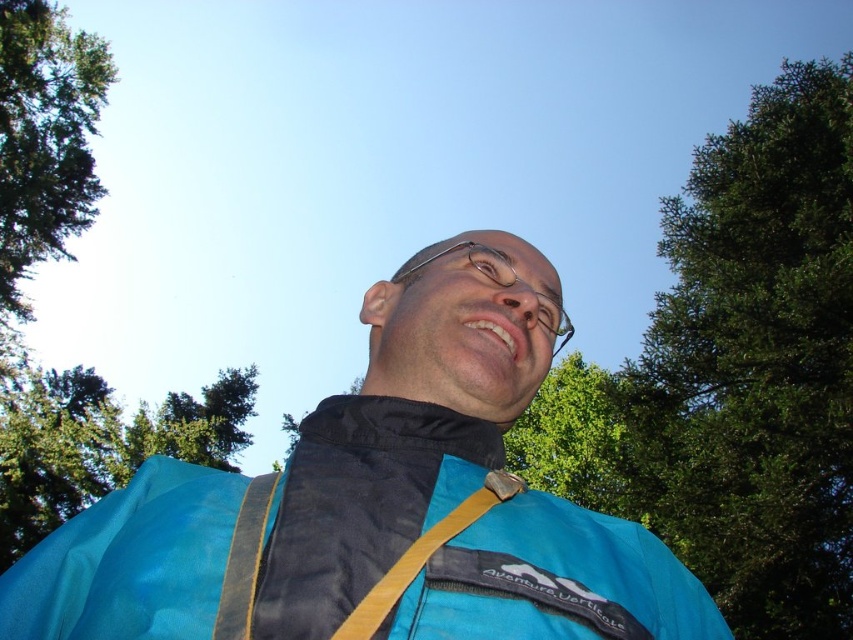
You are a photographer trying to capture a clear photo of the clear plastic glasses at center. However, the green leafy tree at upper right is blocking your view. Can you adjust your position to take the photo without the tree obstructing the glasses?

The clear plastic glasses at center is behind the green leafy tree at upper right, so moving your position to the left or right might allow you to see around the tree and capture the glasses without obstruction.

You are a photographer trying to capture a photo of the blue fabric jacket at center and the green leafy tree at upper right. Which object should you focus on first to ensure both are in sharp focus?

The blue fabric jacket at center is closer to the viewer than the green leafy tree at upper right. To ensure both are in sharp focus, you should focus on the green leafy tree at upper right first because it is farther away, allowing the jacket to be within the depth of field range when focusing on the farther object.

You are a photographer trying to capture the best angle of the person in the scene. You notice two points marked on your camera screen at coordinates point [584,584] and point [405,588]. Which point is closer to the camera lens?

Point [584,584] is further to the viewer than point [405,588], so the point closer to the camera lens is point [405,588].